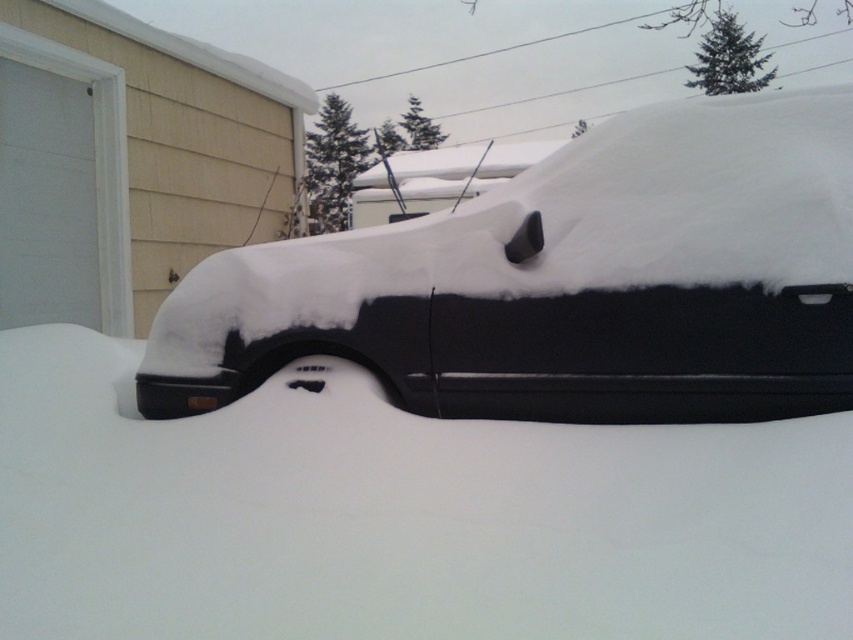
Question: Which of the following is the farthest from the observer?

Choices:
 (A) black matte van at center
 (B) white fluffy snow at center

Answer: (A)

Question: Can you confirm if white fluffy snow at center is wider than black matte van at center?

Choices:
 (A) no
 (B) yes

Answer: (B)

Question: Is white fluffy snow at center in front of black matte van at center?

Choices:
 (A) yes
 (B) no

Answer: (A)

Question: Does white fluffy snow at center lie in front of black matte van at center?

Choices:
 (A) no
 (B) yes

Answer: (B)

Question: Which point is closer to the camera?

Choices:
 (A) white fluffy snow at center
 (B) black matte van at center

Answer: (A)

Question: Which point is farther to the camera?

Choices:
 (A) black matte van at center
 (B) white fluffy snow at center

Answer: (A)